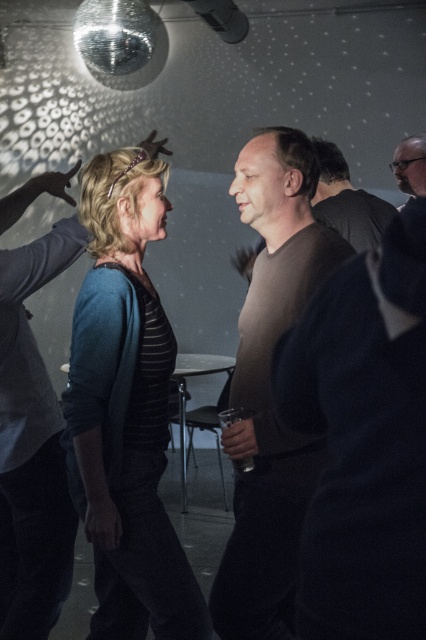
Based on the photo, you are at a party and want to get a drink from the bar. You see the brown matte shirt at center and the bearded man at upper right. Which person is closer to the left side of the scene?

The brown matte shirt at center is positioned on the left side of bearded man at upper right, so the brown matte shirt at center is closer to the left side of the scene.

You are at a party and need to reach the snack table located behind the blue knit sweater at left and the bearded man at upper right. Which person should you go around to get to the snack table more easily?

The blue knit sweater at left is much taller than the bearded man at upper right, so it would be easier to go around the bearded man at upper right to access the snack table since they are shorter and less obstructive.